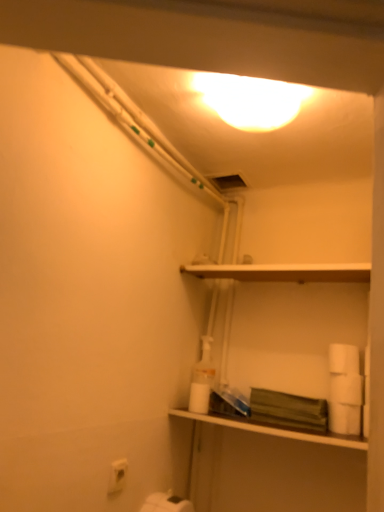
Identify the location of translucent plastic bottle at center. This screenshot has width=384, height=512. (202, 379).

Describe the element at coordinates (282, 272) in the screenshot. I see `white matte shelf at upper center, the second shelf in the bottom-to-top sequence` at that location.

This screenshot has height=512, width=384. What do you see at coordinates (199, 398) in the screenshot?
I see `white matte toilet paper at lower center, which is the 2th toilet paper from left to right` at bounding box center [199, 398].

What is the approximate height of white matte toilet paper at lower right, acting as the 1th toilet paper starting from the right?

white matte toilet paper at lower right, acting as the 1th toilet paper starting from the right, is 4.42 inches tall.

What do you see at coordinates (346, 389) in the screenshot? I see `white matte toilet paper at right, which is the second toilet paper from right to left` at bounding box center [346, 389].

This screenshot has width=384, height=512. In order to click on white matte toilet paper at lower right, placed as the third toilet paper when sorted from left to right in this screenshot , I will do `click(344, 418)`.

Looking at this image, in terms of size, does matte yellow light at upper center appear bigger or smaller than white matte toilet paper at lower right, placed as the third toilet paper when sorted from left to right?

In the image, matte yellow light at upper center appears to be larger than white matte toilet paper at lower right, placed as the third toilet paper when sorted from left to right.

Does matte yellow light at upper center touch white matte toilet paper at lower right, the 3th toilet paper viewed from the right?

No.

Considering the sizes of matte yellow light at upper center and white matte toilet paper at lower right, placed as the third toilet paper when sorted from left to right, in the image, is matte yellow light at upper center wider or thinner than white matte toilet paper at lower right, placed as the third toilet paper when sorted from left to right,?

Clearly, matte yellow light at upper center has more width compared to white matte toilet paper at lower right, placed as the third toilet paper when sorted from left to right.

Between matte yellow light at upper center and white matte toilet paper at lower right, placed as the third toilet paper when sorted from left to right, which one appears on the right side from the viewer's perspective?

white matte toilet paper at lower right, placed as the third toilet paper when sorted from left to right.

Does matte white shelf at center, placed as the first shelf when sorted from bottom to top, have a larger size compared to white matte toilet paper at right, which is the second toilet paper from right to left?

Correct, matte white shelf at center, placed as the first shelf when sorted from bottom to top, is larger in size than white matte toilet paper at right, which is the second toilet paper from right to left.

Which shelf is the 2nd one when counting from the left side of the white matte toilet paper at right, which is the second toilet paper from right to left? Please provide its 2D coordinates.

[(272, 430)]

Considering the relative sizes of matte white shelf at center, the second shelf in the top-to-bottom sequence, and white matte toilet paper at right, the fourth toilet paper positioned from the left, in the image provided, is matte white shelf at center, the second shelf in the top-to-bottom sequence, thinner than white matte toilet paper at right, the fourth toilet paper positioned from the left,?

In fact, matte white shelf at center, the second shelf in the top-to-bottom sequence, might be wider than white matte toilet paper at right, the fourth toilet paper positioned from the left.

Would you say matte white shelf at center, the second shelf in the top-to-bottom sequence, is a long distance from white matte toilet paper at right, which is the second toilet paper from right to left?

No, matte white shelf at center, the second shelf in the top-to-bottom sequence, is not far away from white matte toilet paper at right, which is the second toilet paper from right to left.

Considering the sizes of objects white matte toilet paper at lower right, which is the 5th toilet paper in left-to-right order, and matte white shelf at center, placed as the first shelf when sorted from bottom to top, in the image provided, who is thinner, white matte toilet paper at lower right, which is the 5th toilet paper in left-to-right order, or matte white shelf at center, placed as the first shelf when sorted from bottom to top,?

white matte toilet paper at lower right, which is the 5th toilet paper in left-to-right order.

Between point (336, 373) and point (191, 419), which one is positioned in front?

The point (336, 373) is more forward.

Can you tell me how much translucent plastic bottle at center and white matte toilet paper at lower right, the first toilet paper in the left-to-right sequence, differ in facing direction?

They differ by 93.2 degrees in their facing directions.

Is translucent plastic bottle at center far away from white matte toilet paper at lower right, the first toilet paper in the left-to-right sequence?

No, translucent plastic bottle at center is not far from white matte toilet paper at lower right, the first toilet paper in the left-to-right sequence.

Does translucent plastic bottle at center have a greater height compared to white matte toilet paper at lower right, the first toilet paper in the left-to-right sequence?

Indeed, translucent plastic bottle at center has a greater height compared to white matte toilet paper at lower right, the first toilet paper in the left-to-right sequence.

Does white matte toilet paper at lower right, the 5th toilet paper positioned from the right, have a lesser height compared to white matte toilet paper at lower right, placed as the third toilet paper when sorted from left to right?

Yes, white matte toilet paper at lower right, the 5th toilet paper positioned from the right, is shorter than white matte toilet paper at lower right, placed as the third toilet paper when sorted from left to right.

From the image's perspective, would you say white matte toilet paper at lower right, the first toilet paper in the left-to-right sequence, is positioned over white matte toilet paper at lower right, placed as the third toilet paper when sorted from left to right?

No, from the image's perspective, white matte toilet paper at lower right, the first toilet paper in the left-to-right sequence, is not on top of white matte toilet paper at lower right, placed as the third toilet paper when sorted from left to right.

Considering the sizes of objects white matte toilet paper at lower right, the 5th toilet paper positioned from the right, and white matte toilet paper at lower right, placed as the third toilet paper when sorted from left to right, in the image provided, who is bigger, white matte toilet paper at lower right, the 5th toilet paper positioned from the right, or white matte toilet paper at lower right, placed as the third toilet paper when sorted from left to right,?

white matte toilet paper at lower right, placed as the third toilet paper when sorted from left to right.

Is white matte toilet paper at lower right, the 3th toilet paper viewed from the right, at the back of white matte toilet paper at lower right, the first toilet paper in the left-to-right sequence?

No, white matte toilet paper at lower right, the first toilet paper in the left-to-right sequence,'s orientation is not away from white matte toilet paper at lower right, the 3th toilet paper viewed from the right.

From a real-world perspective, is matte white shelf at center, the second shelf in the top-to-bottom sequence, below white matte toilet paper at lower center, marked as the fourth toilet paper in a right-to-left arrangement?

Indeed, from a real-world perspective, matte white shelf at center, the second shelf in the top-to-bottom sequence, is positioned beneath white matte toilet paper at lower center, marked as the fourth toilet paper in a right-to-left arrangement.

Visually, is matte white shelf at center, placed as the first shelf when sorted from bottom to top, positioned to the left or to the right of white matte toilet paper at lower center, which is the 2th toilet paper from left to right?

matte white shelf at center, placed as the first shelf when sorted from bottom to top, is to the right of white matte toilet paper at lower center, which is the 2th toilet paper from left to right.

In the scene shown: Could you tell me if matte white shelf at center, placed as the first shelf when sorted from bottom to top, is turned towards white matte toilet paper at lower center, which is the 2th toilet paper from left to right?

No, matte white shelf at center, placed as the first shelf when sorted from bottom to top, is not facing towards white matte toilet paper at lower center, which is the 2th toilet paper from left to right.

Is matte white shelf at center, placed as the first shelf when sorted from bottom to top, located within white matte toilet paper at lower center, marked as the fourth toilet paper in a right-to-left arrangement?

Definitely not — matte white shelf at center, placed as the first shelf when sorted from bottom to top, is not inside white matte toilet paper at lower center, marked as the fourth toilet paper in a right-to-left arrangement.

You are a GUI agent. You are given a task and a screenshot of the screen. Output one action in this format:
    pyautogui.click(x=<x>, y=<y>)
    Task: Click on the shelf below the white matte toilet paper at lower center, marked as the fourth toilet paper in a right-to-left arrangement (from a real-world perspective)
    The image size is (384, 512).
    Given the screenshot: What is the action you would take?
    pyautogui.click(x=272, y=430)

From a real-world perspective, who is located higher, white matte toilet paper at lower center, marked as the fourth toilet paper in a right-to-left arrangement, or matte white shelf at center, placed as the first shelf when sorted from bottom to top?

From a 3D spatial view, white matte toilet paper at lower center, marked as the fourth toilet paper in a right-to-left arrangement, is above.

Can you confirm if white matte toilet paper at lower center, which is the 2th toilet paper from left to right, is shorter than matte white shelf at center, the second shelf in the top-to-bottom sequence?

No.

Identify the location of lighting that is above the white matte toilet paper at lower right, placed as the third toilet paper when sorted from left to right (from a real-world perspective). The width and height of the screenshot is (384, 512). (250, 100).

From the matte white shelf at center, the second shelf in the top-to-bottom sequence, count 3rd toilet papers backward and point to it. Please provide its 2D coordinates.

[(346, 389)]

From the image, which object appears to be nearer to white matte toilet paper at lower right, which is the 5th toilet paper in left-to-right order, white matte toilet paper at right, the fourth toilet paper positioned from the left, or white matte toilet paper at lower right, placed as the third toilet paper when sorted from left to right?

Based on the image, white matte toilet paper at right, the fourth toilet paper positioned from the left, appears to be nearer to white matte toilet paper at lower right, which is the 5th toilet paper in left-to-right order.

Estimate the real-world distances between objects in this image. Which object is closer to white matte toilet paper at lower right, the 5th toilet paper positioned from the right, translucent plastic bottle at center or white matte toilet paper at right, which is the second toilet paper from right to left?

translucent plastic bottle at center is closer to white matte toilet paper at lower right, the 5th toilet paper positioned from the right.

From the image, which object appears to be nearer to white matte toilet paper at lower right, the 3th toilet paper viewed from the right, white matte toilet paper at lower right, which is the 5th toilet paper in left-to-right order, or white matte shelf at upper center, marked as the first shelf in a top-to-bottom arrangement?

The object closer to white matte toilet paper at lower right, the 3th toilet paper viewed from the right, is white matte toilet paper at lower right, which is the 5th toilet paper in left-to-right order.

When comparing their distances from matte yellow light at upper center, does white matte toilet paper at lower right, placed as the third toilet paper when sorted from left to right, or white matte toilet paper at right, the fourth toilet paper positioned from the left, seem further?

The object further to matte yellow light at upper center is white matte toilet paper at lower right, placed as the third toilet paper when sorted from left to right.

Considering their positions, is white matte toilet paper at lower right, the 3th toilet paper viewed from the right, positioned further to white matte toilet paper at lower right, acting as the 1th toilet paper starting from the right, than matte white shelf at center, placed as the first shelf when sorted from bottom to top?

matte white shelf at center, placed as the first shelf when sorted from bottom to top, is further to white matte toilet paper at lower right, acting as the 1th toilet paper starting from the right.

Looking at this image, when comparing their distances from white matte toilet paper at lower right, the first toilet paper in the left-to-right sequence, does white matte toilet paper at lower right, acting as the 1th toilet paper starting from the right, or translucent plastic bottle at center seem further?

Based on the image, white matte toilet paper at lower right, acting as the 1th toilet paper starting from the right, appears to be further to white matte toilet paper at lower right, the first toilet paper in the left-to-right sequence.

Estimate the real-world distances between objects in this image. Which object is closer to white matte toilet paper at lower right, placed as the third toilet paper when sorted from left to right, white matte toilet paper at lower right, the first toilet paper in the left-to-right sequence, or white matte shelf at upper center, the second shelf in the bottom-to-top sequence?

The object closer to white matte toilet paper at lower right, placed as the third toilet paper when sorted from left to right, is white matte shelf at upper center, the second shelf in the bottom-to-top sequence.

Based on their spatial positions, is matte yellow light at upper center or white matte toilet paper at lower right, the first toilet paper in the left-to-right sequence, closer to translucent plastic bottle at center?

Based on the image, white matte toilet paper at lower right, the first toilet paper in the left-to-right sequence, appears to be nearer to translucent plastic bottle at center.

Where is `bottle between matte yellow light at upper center and white matte toilet paper at lower right, the 3th toilet paper viewed from the right, in the vertical direction`? This screenshot has width=384, height=512. bottle between matte yellow light at upper center and white matte toilet paper at lower right, the 3th toilet paper viewed from the right, in the vertical direction is located at coordinates (202, 379).

In order to click on bottle between matte yellow light at upper center and white matte toilet paper at lower center, marked as the fourth toilet paper in a right-to-left arrangement, from top to bottom in this screenshot , I will do `click(202, 379)`.

Where is `bottle located between white matte toilet paper at lower center, marked as the fourth toilet paper in a right-to-left arrangement, and white matte toilet paper at right, which is the second toilet paper from right to left, in the left-right direction`? Image resolution: width=384 pixels, height=512 pixels. bottle located between white matte toilet paper at lower center, marked as the fourth toilet paper in a right-to-left arrangement, and white matte toilet paper at right, which is the second toilet paper from right to left, in the left-right direction is located at coordinates (202, 379).

At what (x,y) coordinates should I click in order to perform the action: click on bottle between white matte toilet paper at lower center, which is the 2th toilet paper from left to right, and white matte toilet paper at lower right, placed as the third toilet paper when sorted from left to right, in the horizontal direction. Please return your answer as a coordinate pair (x, y). The width and height of the screenshot is (384, 512). Looking at the image, I should click on (202, 379).